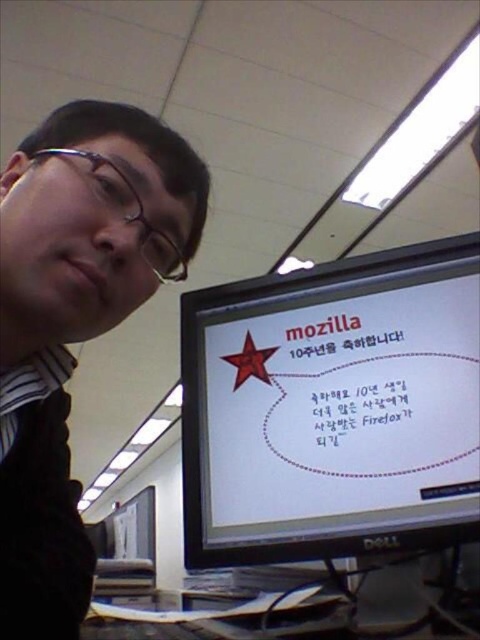
You are an office worker who needs to adjust your glasses. You see the white glossy monitor at center and the matte black glasses at upper left. Which object is located higher in the frame?

The matte black glasses at upper left are located higher in the frame than the white glossy monitor at center.

You are an office worker who needs to adjust your glasses while looking at the white glossy monitor at center. Since your matte black glasses at upper left are currently in your way, can you move them to the left without obstructing your view of the monitor?

The white glossy monitor at center is to the right of the matte black glasses at upper left. Moving the matte black glasses at upper left further to the left would position them away from the monitor, so yes, you can move them to the left without obstructing your view of the white glossy monitor at center.